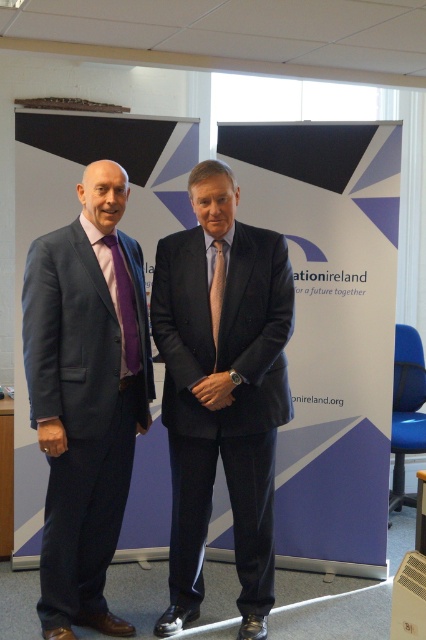
Question: Which point is closer to the camera taking this photo?

Choices:
 (A) (115, 275)
 (B) (83, 509)

Answer: (B)

Question: Among these objects, which one is farthest from the camera?

Choices:
 (A) matte blue suit at left
 (B) matte black suit at center
 (C) purple satin tie at left

Answer: (C)

Question: Is matte black suit at center to the left of silky brown tie at center from the viewer's perspective?

Choices:
 (A) no
 (B) yes

Answer: (A)

Question: Does matte black suit at center have a larger size compared to silky brown tie at center?

Choices:
 (A) yes
 (B) no

Answer: (A)

Question: Which of the following is the closest to the observer?

Choices:
 (A) (290, 321)
 (B) (213, 243)

Answer: (A)

Question: Is matte blue suit at left positioned before silky brown tie at center?

Choices:
 (A) no
 (B) yes

Answer: (B)